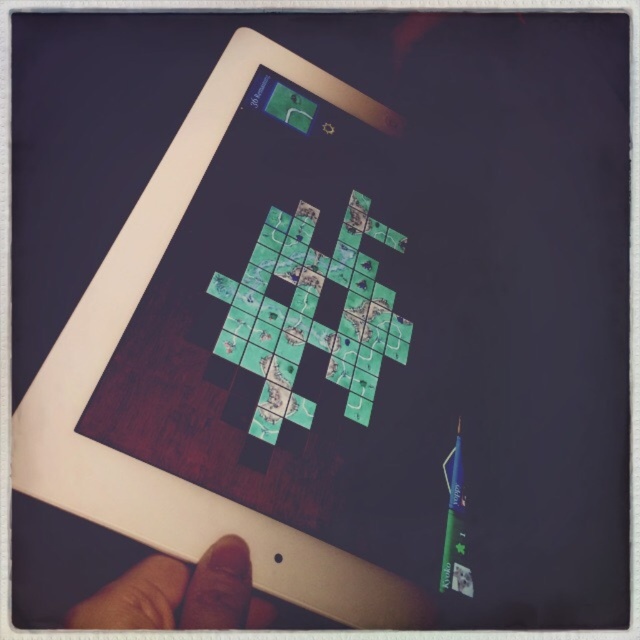
Consider the image. Can you confirm if green matte puzzle pieces at center is positioned above brown skin at lower left?

Correct, green matte puzzle pieces at center is located above brown skin at lower left.

Is point (221, 348) positioned in front of point (124, 600)?

No.

Who is more distant from viewer, (305, 268) or (131, 582)?

The point (305, 268) is behind.

Where is `green matte puzzle pieces at center`? This screenshot has height=640, width=640. green matte puzzle pieces at center is located at coordinates (310, 314).